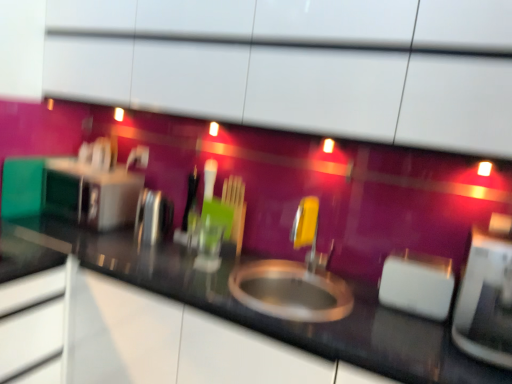
This screenshot has width=512, height=384. What do you see at coordinates (487, 296) in the screenshot? I see `white glossy toaster at right, acting as the first appliance starting from the front` at bounding box center [487, 296].

What do you see at coordinates (152, 217) in the screenshot? I see `polished stainless steel kettle at left, which is the 2th appliance in left-to-right order` at bounding box center [152, 217].

You are a GUI agent. You are given a task and a screenshot of the screen. Output one action in this format:
    pyautogui.click(x=<x>, y=<y>)
    Task: Click on the white plastic toaster at right, the second appliance when ordered from right to left
    
    Given the screenshot: What is the action you would take?
    pyautogui.click(x=417, y=284)

Would you say polished stainless steel kettle at left, which is the third appliance in right-to-left order, is outside yellow plastic faucet at center?

polished stainless steel kettle at left, which is the third appliance in right-to-left order, lies outside yellow plastic faucet at center's area.

Based on the photo, is polished stainless steel kettle at left, which is the third appliance in right-to-left order, positioned before yellow plastic faucet at center?

No, it is not.

What are the coordinates of `the 1st appliance above when counting from the yellow plastic faucet at center (from the image's perspective)` in the screenshot? It's located at (152, 217).

Is point (394, 252) positioned after point (259, 323)?

Yes, point (394, 252) is farther from viewer.

Is white plastic toaster at right, which ranks as the third appliance in left-to-right order, facing away from black glossy countertop at center?

No, black glossy countertop at center is not at the back of white plastic toaster at right, which ranks as the third appliance in left-to-right order.

Who is smaller, white plastic toaster at right, arranged as the 2th appliance when viewed from the front, or black glossy countertop at center?

Smaller between the two is white plastic toaster at right, arranged as the 2th appliance when viewed from the front.

Consider the image. Considering the relative positions of white plastic toaster at right, arranged as the 2th appliance when viewed from the front, and black glossy countertop at center in the image provided, is white plastic toaster at right, arranged as the 2th appliance when viewed from the front, to the left of black glossy countertop at center from the viewer's perspective?

No.

Considering the points (380, 299) and (464, 329), which point is in front, point (380, 299) or point (464, 329)?

The point (464, 329) is in front.

Which of these two, white plastic toaster at right, which ranks as the third appliance in back-to-front order, or white glossy toaster at right, acting as the first appliance starting from the front, is thinner?

white plastic toaster at right, which ranks as the third appliance in back-to-front order.

Is white plastic toaster at right, which ranks as the third appliance in back-to-front order, beside white glossy toaster at right, acting as the first appliance starting from the front?

No, white plastic toaster at right, which ranks as the third appliance in back-to-front order, is not next to white glossy toaster at right, acting as the first appliance starting from the front.

What's the angular difference between white plastic toaster at right, arranged as the 2th appliance when viewed from the front, and white glossy toaster at right, marked as the fourth appliance in a back-to-front arrangement,'s facing directions?

The angular difference between white plastic toaster at right, arranged as the 2th appliance when viewed from the front, and white glossy toaster at right, marked as the fourth appliance in a back-to-front arrangement, is 1.21 degrees.

Is the surface of polished stainless steel kettle at left, which is the third appliance in right-to-left order, in direct contact with satin silver toaster at left, the 4th appliance positioned from the front?

No, polished stainless steel kettle at left, which is the third appliance in right-to-left order, is not next to satin silver toaster at left, the 4th appliance positioned from the front.

Is polished stainless steel kettle at left, which is the 2th appliance in left-to-right order, in front of or behind satin silver toaster at left, which is the 1th appliance in back-to-front order, in the image?

Clearly, polished stainless steel kettle at left, which is the 2th appliance in left-to-right order, is in front of satin silver toaster at left, which is the 1th appliance in back-to-front order.

Locate an element on the screen. The width and height of the screenshot is (512, 384). appliance on the left of the polished stainless steel kettle at left, which is the 2th appliance in left-to-right order is located at coordinates (91, 193).

How different are the orientations of white glossy toaster at right, which is counted as the 4th appliance, starting from the left, and satin silver toaster at left, marked as the fourth appliance in a right-to-left arrangement, in degrees?

The angle between the facing direction of white glossy toaster at right, which is counted as the 4th appliance, starting from the left, and the facing direction of satin silver toaster at left, marked as the fourth appliance in a right-to-left arrangement, is 1.41 degrees.

Is white glossy toaster at right, acting as the first appliance starting from the front, next to satin silver toaster at left, marked as the fourth appliance in a right-to-left arrangement?

No, white glossy toaster at right, acting as the first appliance starting from the front, is not next to satin silver toaster at left, marked as the fourth appliance in a right-to-left arrangement.

Which point is more distant from viewer, (493, 364) or (123, 220)?

Positioned behind is point (123, 220).

Is white glossy toaster at right, acting as the first appliance starting from the front, to the left of satin silver toaster at left, which is the 1th appliance in back-to-front order, from the viewer's perspective?

No, white glossy toaster at right, acting as the first appliance starting from the front, is not to the left of satin silver toaster at left, which is the 1th appliance in back-to-front order.

In the image, is black glossy countertop at center positioned in front of or behind satin silver toaster at left, which is the 1th appliance in back-to-front order?

Visually, black glossy countertop at center is located in front of satin silver toaster at left, which is the 1th appliance in back-to-front order.

Is black glossy countertop at center not inside satin silver toaster at left, the 1th appliance viewed from the left?

That's correct, black glossy countertop at center is outside of satin silver toaster at left, the 1th appliance viewed from the left.

Between black glossy countertop at center and satin silver toaster at left, the 4th appliance positioned from the front, which one appears on the left side from the viewer's perspective?

satin silver toaster at left, the 4th appliance positioned from the front, is more to the left.

How many degrees apart are the facing directions of satin silver toaster at left, the 4th appliance positioned from the front, and yellow plastic faucet at center?

The angle between the facing direction of satin silver toaster at left, the 4th appliance positioned from the front, and the facing direction of yellow plastic faucet at center is 2.66 degrees.

Is satin silver toaster at left, the 1th appliance viewed from the left, at the left side of yellow plastic faucet at center?

Yes, satin silver toaster at left, the 1th appliance viewed from the left, is to the left of yellow plastic faucet at center.

Can you confirm if satin silver toaster at left, the 4th appliance positioned from the front, is wider than yellow plastic faucet at center?

Indeed, satin silver toaster at left, the 4th appliance positioned from the front, has a greater width compared to yellow plastic faucet at center.

Is the depth of satin silver toaster at left, the 4th appliance positioned from the front, greater than that of yellow plastic faucet at center?

Yes, satin silver toaster at left, the 4th appliance positioned from the front, is further from the camera.

Where is `faucet that appears on the right of polished stainless steel kettle at left, arranged as the 2th appliance when viewed from the back`? faucet that appears on the right of polished stainless steel kettle at left, arranged as the 2th appliance when viewed from the back is located at coordinates (306, 229).

Identify the location of countertop below the white plastic toaster at right, arranged as the 2th appliance when viewed from the front (from the image's perspective). The height and width of the screenshot is (384, 512). (279, 319).

Estimate the real-world distances between objects in this image. Which object is closer to white plastic toaster at right, arranged as the 2th appliance when viewed from the front, polished stainless steel kettle at left, arranged as the 2th appliance when viewed from the back, or yellow plastic faucet at center?

yellow plastic faucet at center is closer to white plastic toaster at right, arranged as the 2th appliance when viewed from the front.

Looking at the image, which one is located closer to white glossy toaster at right, acting as the first appliance starting from the front, black glossy countertop at center or yellow plastic faucet at center?

black glossy countertop at center.

When comparing their distances from satin silver toaster at left, marked as the fourth appliance in a right-to-left arrangement, does white plastic toaster at right, the second appliance when ordered from right to left, or polished stainless steel kettle at left, which is the third appliance in right-to-left order, seem closer?

Based on the image, polished stainless steel kettle at left, which is the third appliance in right-to-left order, appears to be nearer to satin silver toaster at left, marked as the fourth appliance in a right-to-left arrangement.

Looking at the image, which one is located further to black glossy countertop at center, satin silver toaster at left, which is the 1th appliance in back-to-front order, or white plastic toaster at right, the second appliance when ordered from right to left?

satin silver toaster at left, which is the 1th appliance in back-to-front order, is positioned further to the anchor black glossy countertop at center.

Looking at the image, which one is located closer to satin silver toaster at left, which is the 1th appliance in back-to-front order, yellow plastic faucet at center or polished stainless steel kettle at left, which is the third appliance in right-to-left order?

The object closer to satin silver toaster at left, which is the 1th appliance in back-to-front order, is polished stainless steel kettle at left, which is the third appliance in right-to-left order.

Considering their positions, is satin silver toaster at left, marked as the fourth appliance in a right-to-left arrangement, positioned further to white glossy toaster at right, which is counted as the 4th appliance, starting from the left, than white plastic toaster at right, arranged as the 2th appliance when viewed from the front?

satin silver toaster at left, marked as the fourth appliance in a right-to-left arrangement.

Based on their spatial positions, is black glossy countertop at center or white glossy toaster at right, marked as the fourth appliance in a back-to-front arrangement, closer to yellow plastic faucet at center?

black glossy countertop at center is positioned closer to the anchor yellow plastic faucet at center.

Which object lies further to the anchor point white glossy toaster at right, which is counted as the 4th appliance, starting from the left, black glossy countertop at center or polished stainless steel kettle at left, arranged as the 2th appliance when viewed from the back?

polished stainless steel kettle at left, arranged as the 2th appliance when viewed from the back, is positioned further to the anchor white glossy toaster at right, which is counted as the 4th appliance, starting from the left.

Where is `appliance located between white glossy toaster at right, which is counted as the 4th appliance, starting from the left, and yellow plastic faucet at center in the depth direction`? appliance located between white glossy toaster at right, which is counted as the 4th appliance, starting from the left, and yellow plastic faucet at center in the depth direction is located at coordinates (417, 284).

Image resolution: width=512 pixels, height=384 pixels. What are the coordinates of `countertop between satin silver toaster at left, the 4th appliance positioned from the front, and white plastic toaster at right, which ranks as the third appliance in back-to-front order, in the horizontal direction` in the screenshot? It's located at (279, 319).

This screenshot has height=384, width=512. What are the coordinates of `faucet between black glossy countertop at center and polished stainless steel kettle at left, which is the third appliance in right-to-left order, in the front-back direction` in the screenshot? It's located at (306, 229).

Where is `appliance between polished stainless steel kettle at left, which ranks as the 3th appliance in front-to-back order, and white glossy toaster at right, which is the 1th appliance from right to left, from left to right`? appliance between polished stainless steel kettle at left, which ranks as the 3th appliance in front-to-back order, and white glossy toaster at right, which is the 1th appliance from right to left, from left to right is located at coordinates (417, 284).